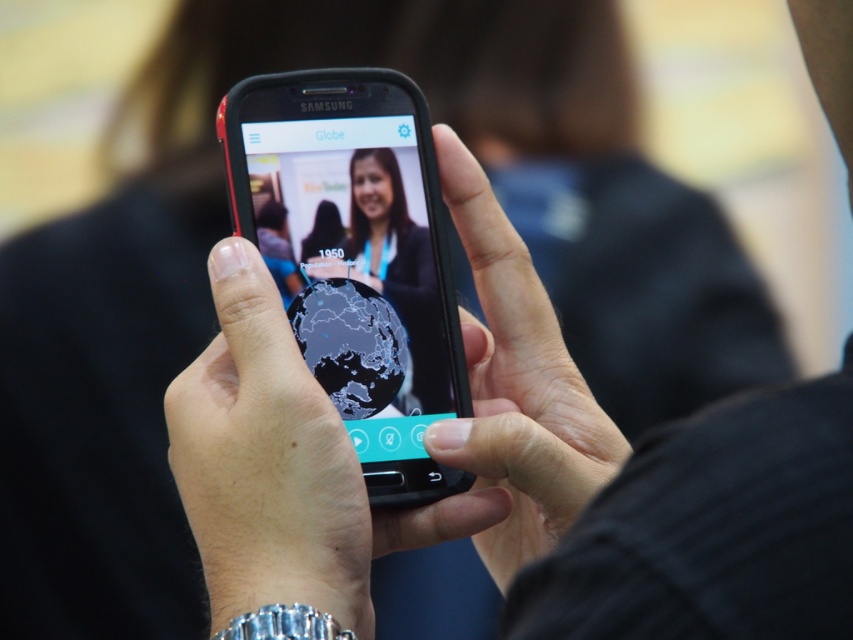
Question: Does black glossy phone at center come behind matte black globe at center?

Choices:
 (A) yes
 (B) no

Answer: (B)

Question: Is black matte phone at center bigger than smooth skin hand at center?

Choices:
 (A) no
 (B) yes

Answer: (B)

Question: Which object appears farthest from the camera in this image?

Choices:
 (A) black matte phone at center
 (B) matte black globe at center

Answer: (B)

Question: Does black glossy phone at center appear on the left side of matte black globe at center?

Choices:
 (A) yes
 (B) no

Answer: (A)

Question: Which of these objects is positioned closest to the black matte phone at center?

Choices:
 (A) smooth skin hand at center
 (B) black glossy phone at center
 (C) matte black globe at center

Answer: (A)

Question: Which object is farther from the camera taking this photo?

Choices:
 (A) matte black globe at center
 (B) smooth skin hand at center

Answer: (A)